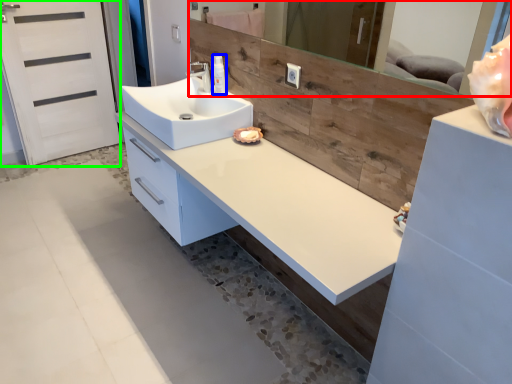
Question: Based on their relative distances, which object is farther from mirror (highlighted by a red box)? Choose from toiletry (highlighted by a blue box) and screen door (highlighted by a green box).

Choices:
 (A) toiletry
 (B) screen door

Answer: (B)